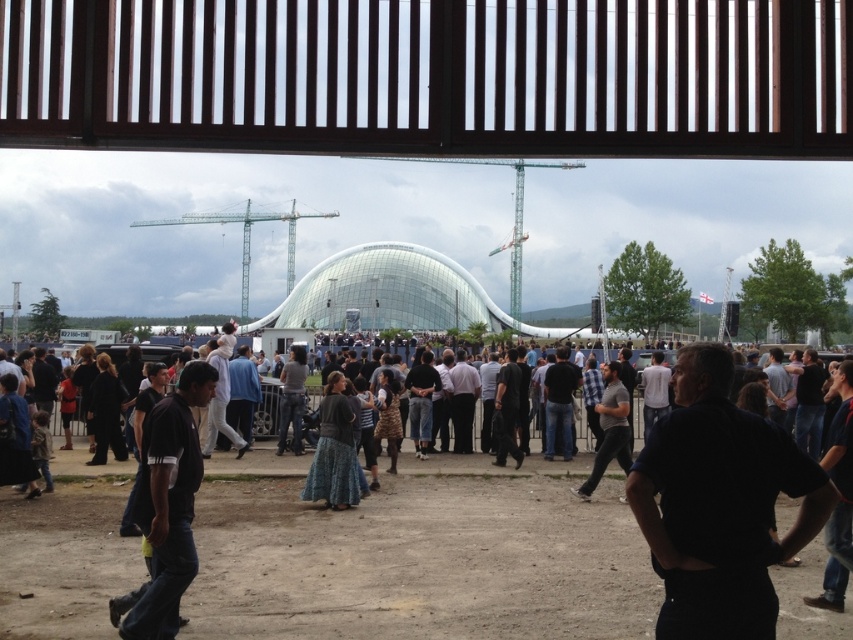
You are a photographer trying to capture a candid shot of the dark blue shirt at center and denim skirt at center from behind the wooden slatted structure. Which one will be more visible in your photo?

The dark blue shirt at center is positioned over denim skirt at center, so the dark blue shirt at center will be more visible in the photo since it is in a higher position.

You are a photographer trying to capture a clear shot of the gray cotton shirt at center without the dark blue jeans at lower left blocking it. Based on the scene, can you adjust your position to achieve this?

The dark blue jeans at lower left is positioned over gray cotton shirt at center, so moving your camera angle downward would allow you to capture the gray cotton shirt at center without obstruction from the dark blue jeans at lower left.